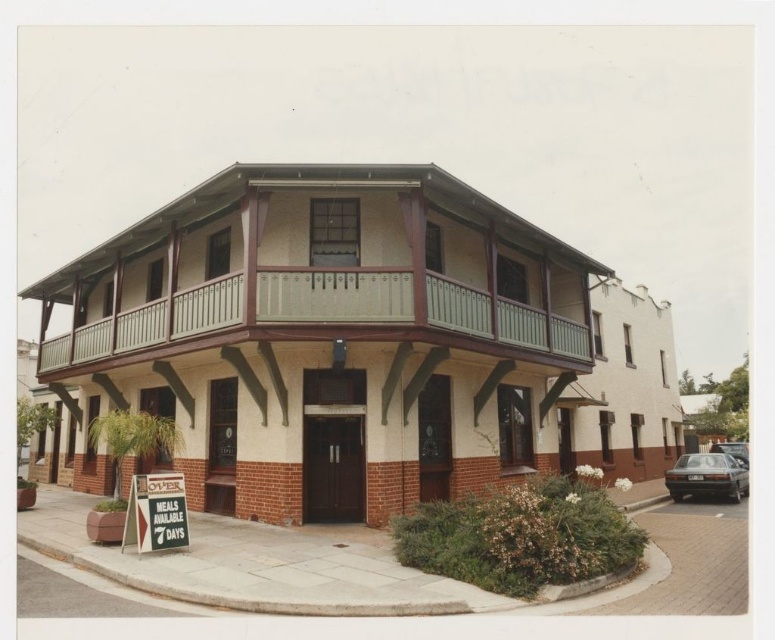
Question: Considering the real-world distances, which object is closest to the dark gray metallic sedan at lower right?

Choices:
 (A) green painted wood at upper center
 (B) metallic silver car at lower right

Answer: (B)

Question: Which point is closer to the camera?

Choices:
 (A) dark gray metallic sedan at lower right
 (B) green painted wood at upper center
 (C) metallic silver car at lower right

Answer: (B)

Question: Which object is the farthest from the dark gray metallic sedan at lower right?

Choices:
 (A) green painted wood at upper center
 (B) metallic silver car at lower right

Answer: (A)

Question: Where is green painted wood at upper center located in relation to dark gray metallic sedan at lower right in the image?

Choices:
 (A) above
 (B) below

Answer: (A)

Question: Can you confirm if green painted wood at upper center is positioned to the left of metallic silver car at lower right?

Choices:
 (A) no
 (B) yes

Answer: (B)

Question: Where is dark gray metallic sedan at lower right located in relation to metallic silver car at lower right in the image?

Choices:
 (A) right
 (B) left

Answer: (B)